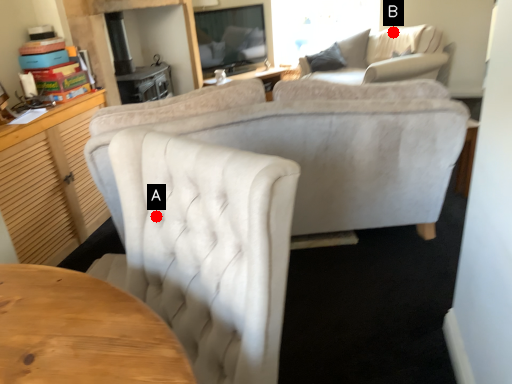
Question: Two points are circled on the image, labeled by A and B beside each circle. Among these points, which one is nearest to the camera?

Choices:
 (A) A is closer
 (B) B is closer

Answer: (A)